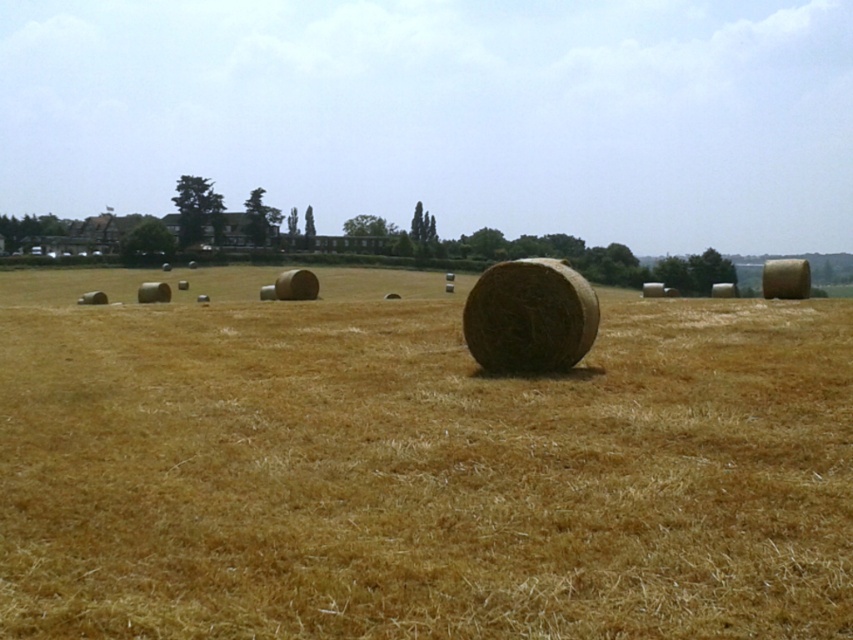
Question: From the image, what is the correct spatial relationship of dry straw at center in relation to natural straw bale at center?

Choices:
 (A) below
 (B) above

Answer: (B)

Question: Is dry straw at center thinner than natural straw bale at center?

Choices:
 (A) yes
 (B) no

Answer: (B)

Question: Which object is farther from the camera taking this photo?

Choices:
 (A) natural straw bale at center
 (B) dry straw at center

Answer: (A)

Question: Is dry straw at center to the left of natural straw bale at center from the viewer's perspective?

Choices:
 (A) yes
 (B) no

Answer: (A)

Question: Which point is closer to the camera?

Choices:
 (A) (555, 595)
 (B) (587, 342)

Answer: (A)

Question: Which object appears closest to the camera in this image?

Choices:
 (A) natural straw bale at center
 (B) dry straw at center

Answer: (B)